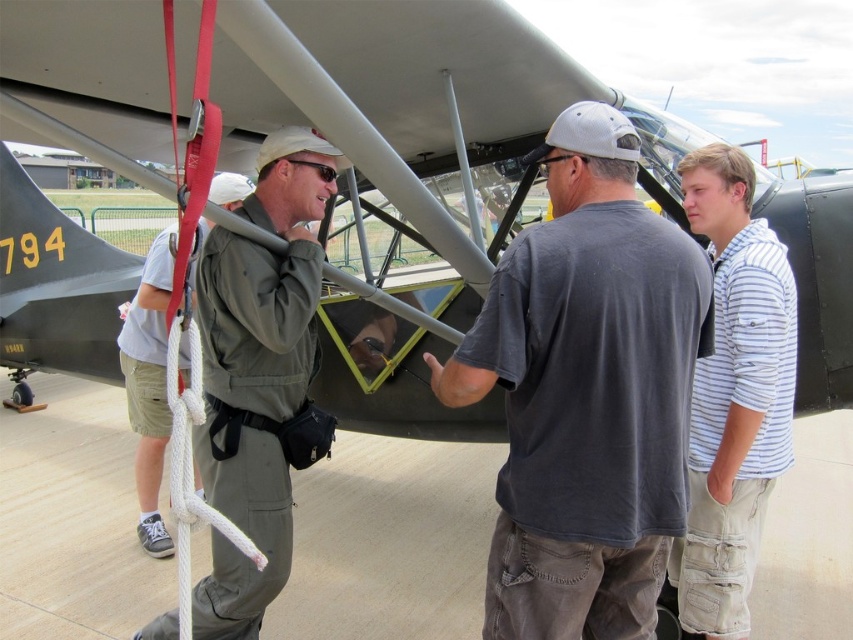
Question: Can you confirm if dark gray t-shirt at center is smaller than green fabric pilot jacket at center?

Choices:
 (A) yes
 (B) no

Answer: (A)

Question: Which point is closer to the camera?

Choices:
 (A) (590, 634)
 (B) (699, 148)
 (C) (51, 1)

Answer: (C)

Question: Is green matte airplane at center smaller than white striped shirt at right?

Choices:
 (A) yes
 (B) no

Answer: (B)

Question: Can you confirm if dark gray t-shirt at center is positioned to the right of green fabric jacket at center?

Choices:
 (A) yes
 (B) no

Answer: (A)

Question: Which of these objects is positioned farthest from the dark gray t-shirt at center?

Choices:
 (A) white striped shirt at right
 (B) green fabric pilot jacket at center
 (C) green fabric jacket at center

Answer: (C)

Question: Which point appears farthest from the camera in this image?

Choices:
 (A) (490, 547)
 (B) (408, 410)
 (C) (144, 392)
 (D) (241, 563)

Answer: (B)